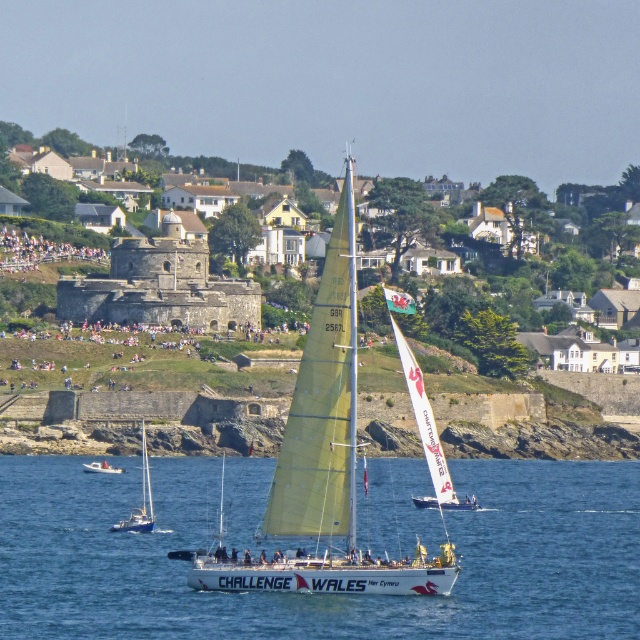
Question: Does white water at center appear on the left side of white sailboat at lower left?

Choices:
 (A) yes
 (B) no

Answer: (B)

Question: Can you confirm if white sailboat at lower left is smaller than white plastic boat at lower left?

Choices:
 (A) no
 (B) yes

Answer: (A)

Question: Considering the real-world distances, which object is farthest from the white matte sailboat at center?

Choices:
 (A) white plastic boat at lower left
 (B) white sailboat at lower left

Answer: (A)

Question: Which object is the farthest from the white water at center?

Choices:
 (A) white sailboat at lower left
 (B) white plastic boat at lower left
 (C) white matte sailboat at center

Answer: (B)

Question: In this image, where is white water at center located relative to white sailboat at lower left?

Choices:
 (A) right
 (B) left

Answer: (A)

Question: Considering the real-world distances, which object is closest to the white sailboat at lower left?

Choices:
 (A) white plastic boat at lower left
 (B) white water at center
 (C) white matte sailboat at center

Answer: (A)